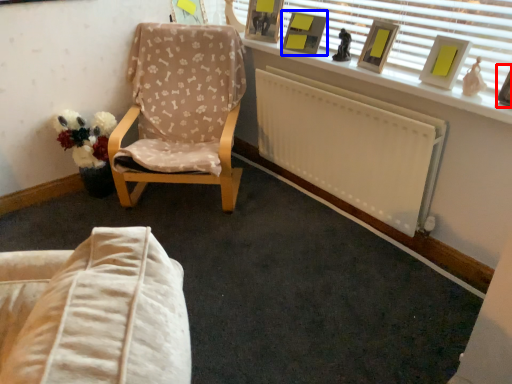
Question: Among these objects, which one is farthest to the camera, picture frame (highlighted by a red box) or picture frame (highlighted by a blue box)?

Choices:
 (A) picture frame
 (B) picture frame

Answer: (B)